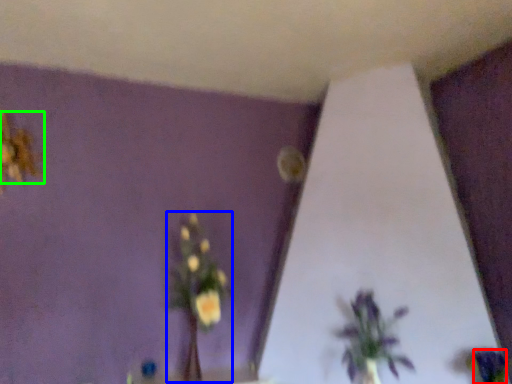
Question: Based on their relative distances, which object is farther from flower (highlighted by a red box)? Choose from floral arrangement (highlighted by a blue box) and flower (highlighted by a green box).

Choices:
 (A) floral arrangement
 (B) flower

Answer: (B)